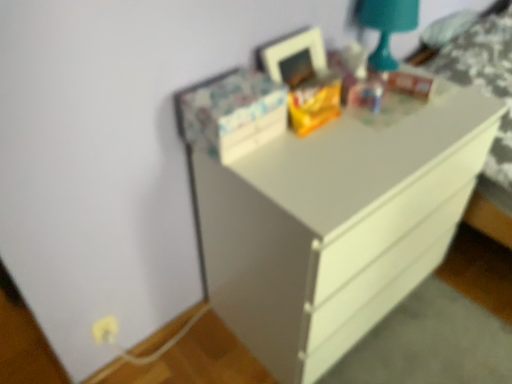
The image size is (512, 384). Describe the element at coordinates (336, 226) in the screenshot. I see `white glossy chest of drawers at center` at that location.

The height and width of the screenshot is (384, 512). In order to click on white glossy chest of drawers at center in this screenshot , I will do pos(336,226).

Image resolution: width=512 pixels, height=384 pixels. Describe the element at coordinates (386, 26) in the screenshot. I see `teal glossy lamp at upper right` at that location.

Locate an element on the screen. The width and height of the screenshot is (512, 384). teal glossy lamp at upper right is located at coordinates (386, 26).

In order to face teal glossy lamp at upper right, should I rotate leftwards or rightwards?

A 17.276 degree turn to the right will do.

Find the location of `white glossy chest of drawers at center`. white glossy chest of drawers at center is located at coordinates pyautogui.click(x=336, y=226).

Considering the relative positions of teal glossy lamp at upper right and white glossy chest of drawers at center in the image provided, is teal glossy lamp at upper right to the right of white glossy chest of drawers at center from the viewer's perspective?

Yes.

Who is more distant, teal glossy lamp at upper right or white glossy chest of drawers at center?

teal glossy lamp at upper right.

Does point (386, 54) lie in front of point (303, 297)?

No, it is behind (303, 297).

From the image's perspective, relative to white glossy chest of drawers at center, is teal glossy lamp at upper right above or below?

From the image's perspective, teal glossy lamp at upper right appears above white glossy chest of drawers at center.

From a real-world perspective, is teal glossy lamp at upper right beneath white glossy chest of drawers at center?

Actually, teal glossy lamp at upper right is physically above white glossy chest of drawers at center in the real world.

Does teal glossy lamp at upper right have a greater width compared to white glossy chest of drawers at center?

No.

Looking at this image, who is taller, teal glossy lamp at upper right or white glossy chest of drawers at center?

Standing taller between the two is white glossy chest of drawers at center.

Based on the photo, who is bigger, teal glossy lamp at upper right or white glossy chest of drawers at center?

white glossy chest of drawers at center is bigger.

Is teal glossy lamp at upper right inside or outside of white glossy chest of drawers at center?

teal glossy lamp at upper right is outside white glossy chest of drawers at center.

Would you say teal glossy lamp at upper right is a long distance from white glossy chest of drawers at center?

Actually, teal glossy lamp at upper right and white glossy chest of drawers at center are a little close together.

Could you tell me if teal glossy lamp at upper right is turned towards white glossy chest of drawers at center?

No, teal glossy lamp at upper right is not turned towards white glossy chest of drawers at center.

Measure the distance between teal glossy lamp at upper right and white glossy chest of drawers at center.

They are 22.81 inches apart.

Locate an element on the screen. Image resolution: width=512 pixels, height=384 pixels. bedside lamp lying behind the white glossy chest of drawers at center is located at coordinates (386, 26).

Considering the relative positions of white glossy chest of drawers at center and teal glossy lamp at upper right in the image provided, is white glossy chest of drawers at center to the left or to the right of teal glossy lamp at upper right?

white glossy chest of drawers at center is positioned on teal glossy lamp at upper right's left side.

Considering the positions of objects white glossy chest of drawers at center and teal glossy lamp at upper right in the image provided, who is in front, white glossy chest of drawers at center or teal glossy lamp at upper right?

white glossy chest of drawers at center is closer to the camera.

Is point (375, 230) closer or farther from the camera than point (397, 20)?

Point (375, 230) appears to be closer to the viewer than point (397, 20).

From the image's perspective, is white glossy chest of drawers at center over teal glossy lamp at upper right?

Actually, white glossy chest of drawers at center appears below teal glossy lamp at upper right in the image.

From a real-world perspective, is white glossy chest of drawers at center physically above teal glossy lamp at upper right?

Incorrect, from a real-world perspective, white glossy chest of drawers at center is lower than teal glossy lamp at upper right.

Considering the sizes of white glossy chest of drawers at center and teal glossy lamp at upper right in the image, is white glossy chest of drawers at center wider or thinner than teal glossy lamp at upper right?

In the image, white glossy chest of drawers at center appears to be wider than teal glossy lamp at upper right.

Looking at this image, does white glossy chest of drawers at center have a greater height compared to teal glossy lamp at upper right?

Yes.

Does white glossy chest of drawers at center have a smaller size compared to teal glossy lamp at upper right?

No, white glossy chest of drawers at center is not smaller than teal glossy lamp at upper right.

Which is correct: white glossy chest of drawers at center is inside teal glossy lamp at upper right, or outside of it?

white glossy chest of drawers at center is located beyond the bounds of teal glossy lamp at upper right.

Is white glossy chest of drawers at center positioned far away from teal glossy lamp at upper right?

No, white glossy chest of drawers at center is in close proximity to teal glossy lamp at upper right.

Looking at this image, is white glossy chest of drawers at center oriented towards teal glossy lamp at upper right?

No, white glossy chest of drawers at center is not oriented towards teal glossy lamp at upper right.

Where is `bedside lamp lying on the right of white glossy chest of drawers at center`? The image size is (512, 384). bedside lamp lying on the right of white glossy chest of drawers at center is located at coordinates (386, 26).

This screenshot has height=384, width=512. Identify the location of chest of drawers below the teal glossy lamp at upper right (from the image's perspective). (336, 226).

This screenshot has height=384, width=512. Identify the location of chest of drawers below the teal glossy lamp at upper right (from a real-world perspective). (336, 226).